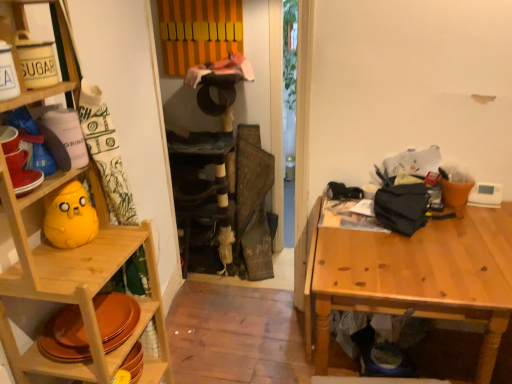
Question: Are matte yellow plush at left and wooden table at right located far from each other?

Choices:
 (A) yes
 (B) no

Answer: (B)

Question: Can you confirm if matte yellow plush at left is taller than wooden table at right?

Choices:
 (A) yes
 (B) no

Answer: (B)

Question: Is matte yellow plush at left further to the viewer compared to wooden table at right?

Choices:
 (A) yes
 (B) no

Answer: (B)

Question: Does matte yellow plush at left have a smaller size compared to wooden table at right?

Choices:
 (A) no
 (B) yes

Answer: (B)

Question: From a real-world perspective, does matte yellow plush at left sit lower than wooden table at right?

Choices:
 (A) no
 (B) yes

Answer: (A)

Question: Is matte yellow plush at left outside of wooden table at right?

Choices:
 (A) yes
 (B) no

Answer: (A)

Question: Considering the relative sizes of wooden shelf at left and matte yellow plush at left in the image provided, is wooden shelf at left smaller than matte yellow plush at left?

Choices:
 (A) yes
 (B) no

Answer: (B)

Question: Does wooden shelf at left have a greater height compared to matte yellow plush at left?

Choices:
 (A) yes
 (B) no

Answer: (A)

Question: Does wooden shelf at left have a lesser height compared to matte yellow plush at left?

Choices:
 (A) no
 (B) yes

Answer: (A)

Question: Is wooden shelf at left positioned with its back to matte yellow plush at left?

Choices:
 (A) yes
 (B) no

Answer: (A)

Question: Can you confirm if wooden shelf at left is bigger than matte yellow plush at left?

Choices:
 (A) no
 (B) yes

Answer: (B)

Question: From a real-world perspective, is wooden shelf at left positioned under matte yellow plush at left based on gravity?

Choices:
 (A) yes
 (B) no

Answer: (A)

Question: Is wooden shelf at left next to wooden table at right and touching it?

Choices:
 (A) yes
 (B) no

Answer: (B)